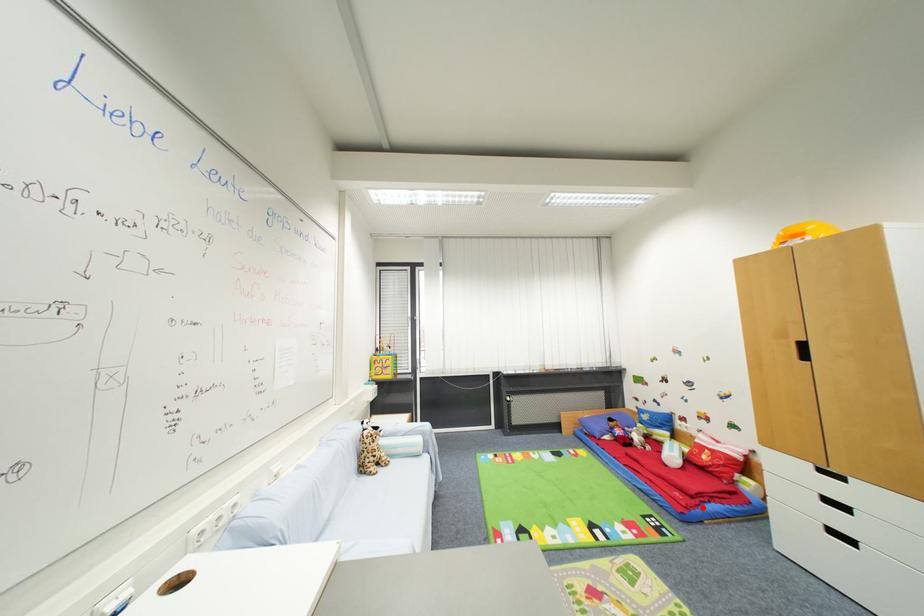
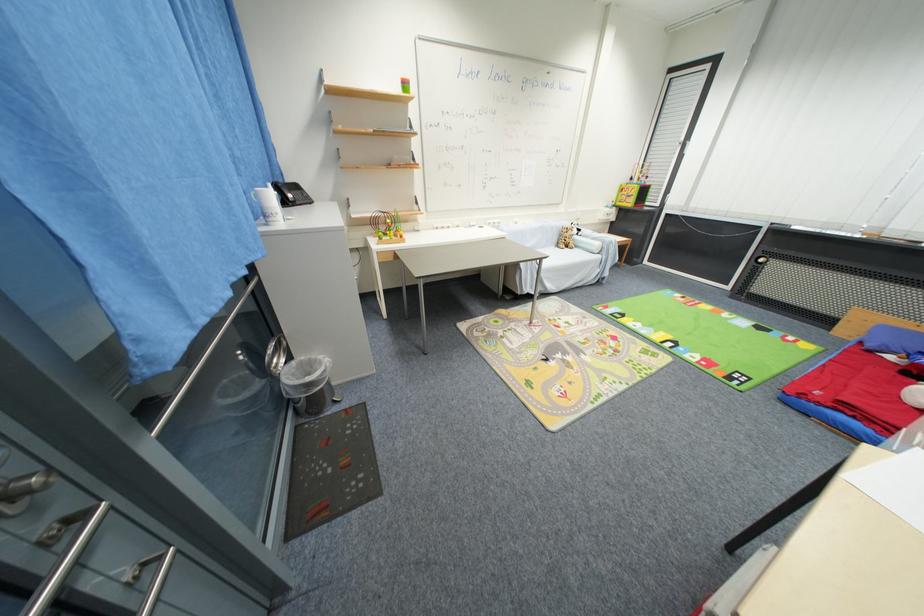
Question: A red point is marked in image1. In image2, is the corresponding 3D point closer to the camera or farther? Reply with the corresponding letter.

Choices:
 (A) The corresponding 3D point is closer.
 (B) The corresponding 3D point is farther.

Answer: (B)